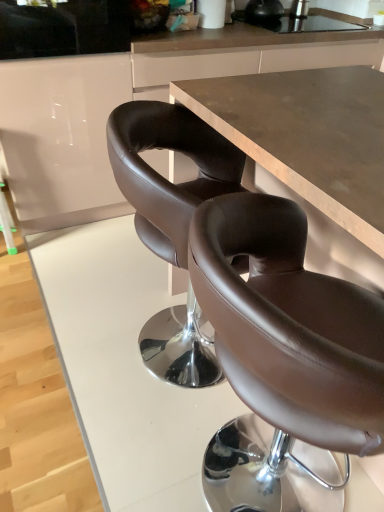
Find the location of a particular element. The image size is (384, 512). vacant area that lies in front of white glossy cabinet at upper left is located at coordinates (79, 265).